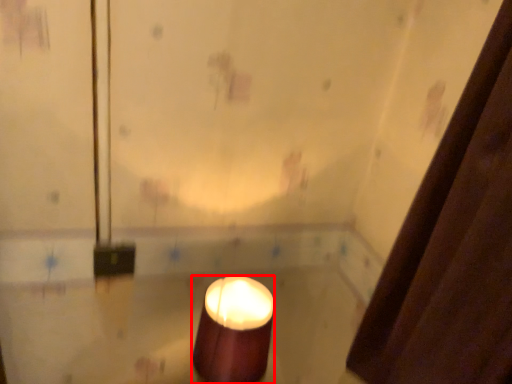
Question: Where is candle (annotated by the red box) located in relation to shower curtain in the image?

Choices:
 (A) left
 (B) right

Answer: (A)